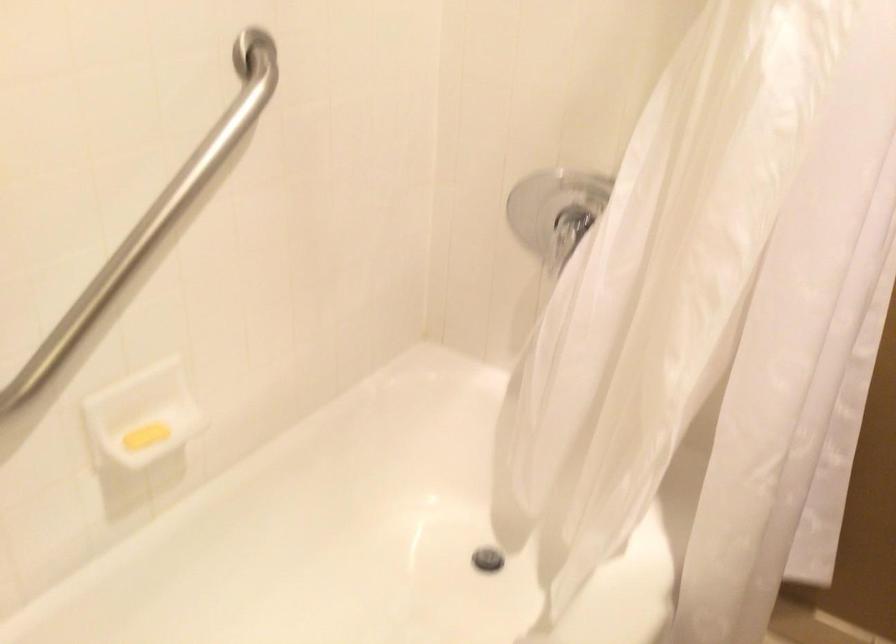
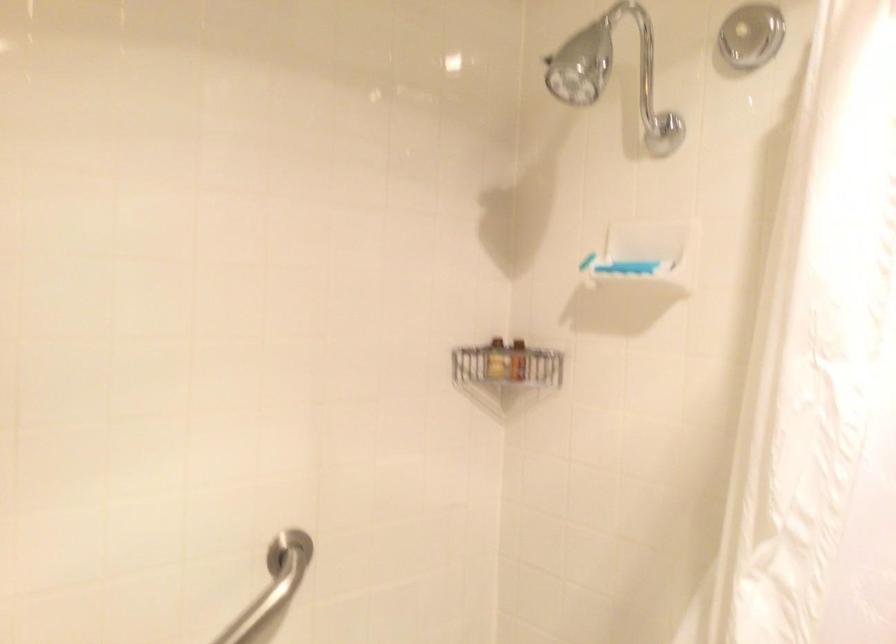
The first image is from the beginning of the video and the second image is from the end. How did the camera likely rotate when shooting the video?

The camera's rotation is toward left-up.